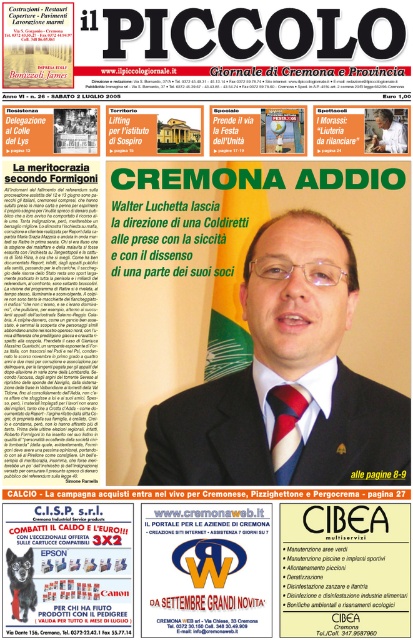
Question: Which point is farther to the camera?

Choices:
 (A) matte black suit at center
 (B) matte green tie at center
 (C) red silk tie at center

Answer: (C)

Question: Which of the following is the closest to the observer?

Choices:
 (A) brown leather wallet at center
 (B) matte black suit at center
 (C) matte green tie at center
 (D) red silk tie at center

Answer: (B)

Question: Is matte green tie at center bigger than brown leather wallet at center?

Choices:
 (A) yes
 (B) no

Answer: (A)

Question: Is matte black suit at center closer to camera compared to red silk tie at center?

Choices:
 (A) yes
 (B) no

Answer: (A)

Question: From the image, what is the correct spatial relationship of matte green tie at center in relation to matte black suit at center?

Choices:
 (A) below
 (B) above

Answer: (B)

Question: Which point is closer to the camera?

Choices:
 (A) (211, 419)
 (B) (379, 116)
 (C) (372, 401)
 (D) (287, 422)

Answer: (D)